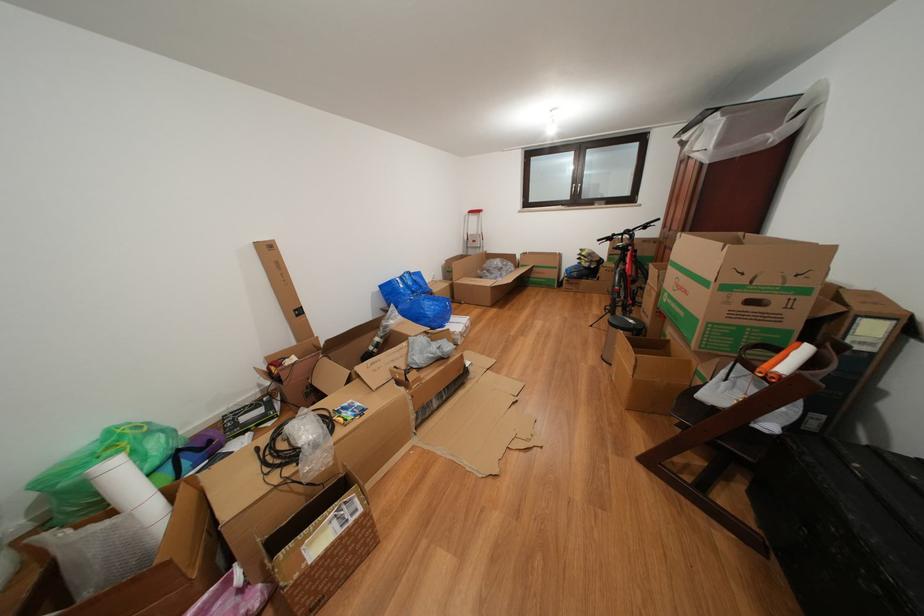
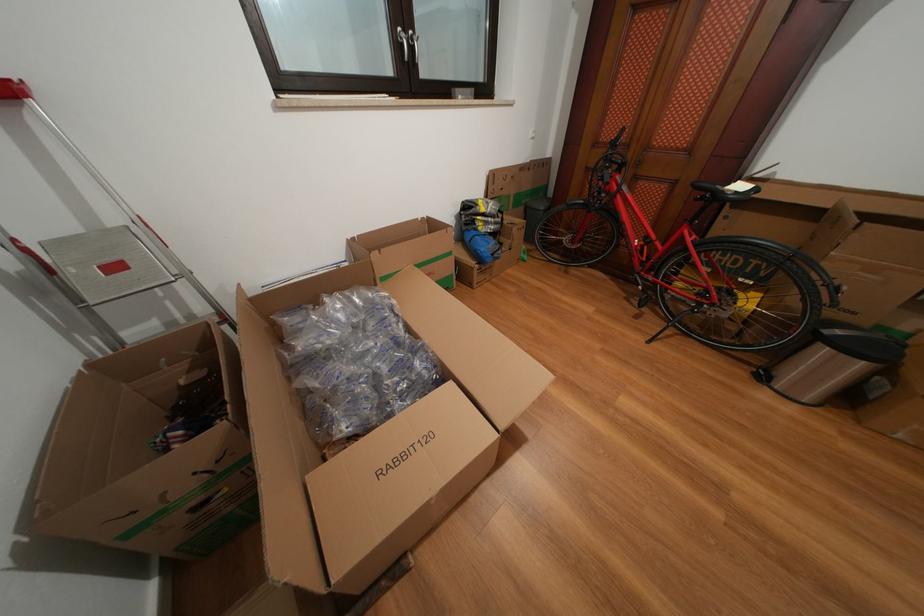
Find the pixel in the second image that matches the point at 482,246 in the first image.

(124, 273)